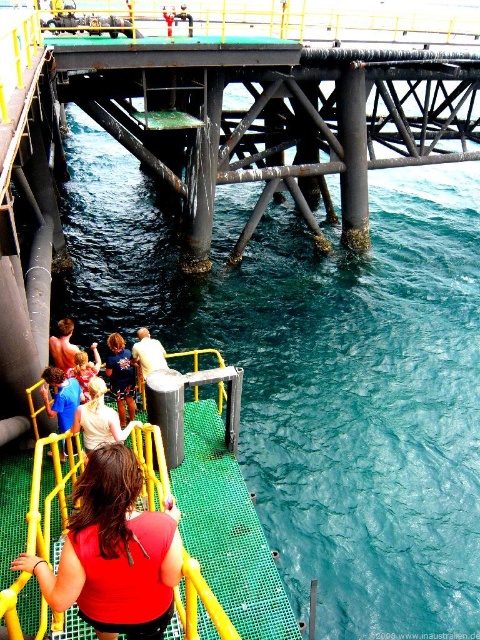
Question: Where is red fabric shirt at lower center located in relation to light brown leather jacket at lower center in the image?

Choices:
 (A) left
 (B) right

Answer: (B)

Question: Which point is closer to the camera taking this photo?

Choices:
 (A) (148, 637)
 (B) (132, 401)

Answer: (A)

Question: Is blue denim shorts at lower left in front of blue denim shirt at lower left?

Choices:
 (A) yes
 (B) no

Answer: (B)

Question: Which object is farther from the camera taking this photo?

Choices:
 (A) blue denim shorts at lower left
 (B) light brown leather jacket at lower center

Answer: (B)

Question: Among these points, which one is nearest to the camera?

Choices:
 (A) (153, 339)
 (B) (87, 584)
 (C) (155, 435)

Answer: (B)

Question: Is blonde hair at lower center to the right of blue denim shirt at lower left from the viewer's perspective?

Choices:
 (A) no
 (B) yes

Answer: (B)